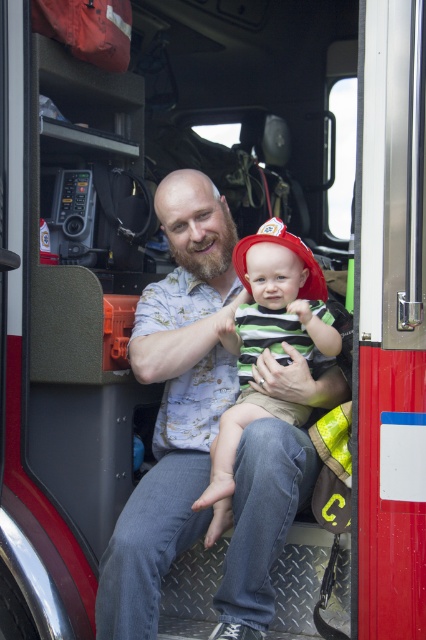
Is point (143, 291) positioned in front of point (252, 401)?

No, it is behind (252, 401).

What do you see at coordinates (173, 401) in the screenshot? I see `matte blue shirt at center` at bounding box center [173, 401].

Who is more distant from viewer, (232, 301) or (296, 419)?

The point (232, 301) is more distant.

This screenshot has height=640, width=426. I want to click on matte blue shirt at center, so click(173, 401).